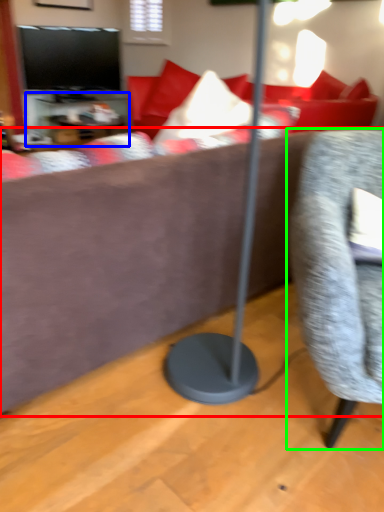
Question: Which object is positioned farthest from studio couch (highlighted by a red box)? Select from table (highlighted by a blue box) and chair (highlighted by a green box).

Choices:
 (A) table
 (B) chair

Answer: (A)